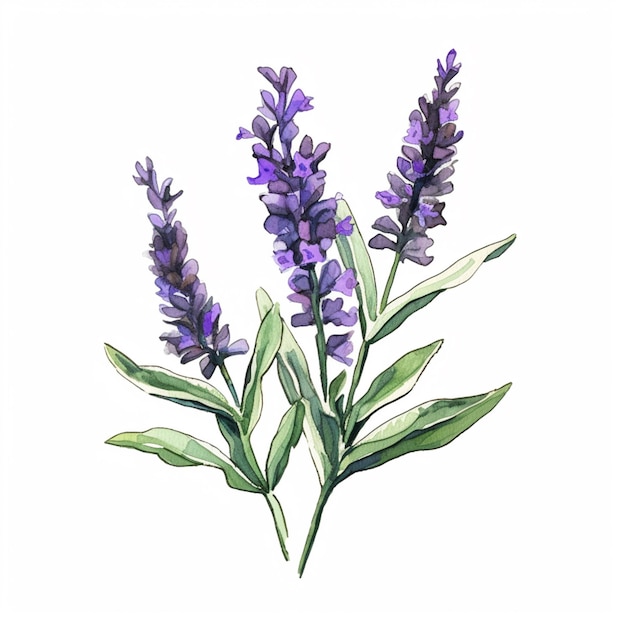
You are a GUI agent. You are given a task and a screenshot of the screen. Output one action in this format:
    pyautogui.click(x=<x>, y=<y>)
    Task: Click on the watercolor painting of lavender flowers
    The image size is (626, 626).
    Given the screenshot: What is the action you would take?
    pyautogui.click(x=27, y=28)